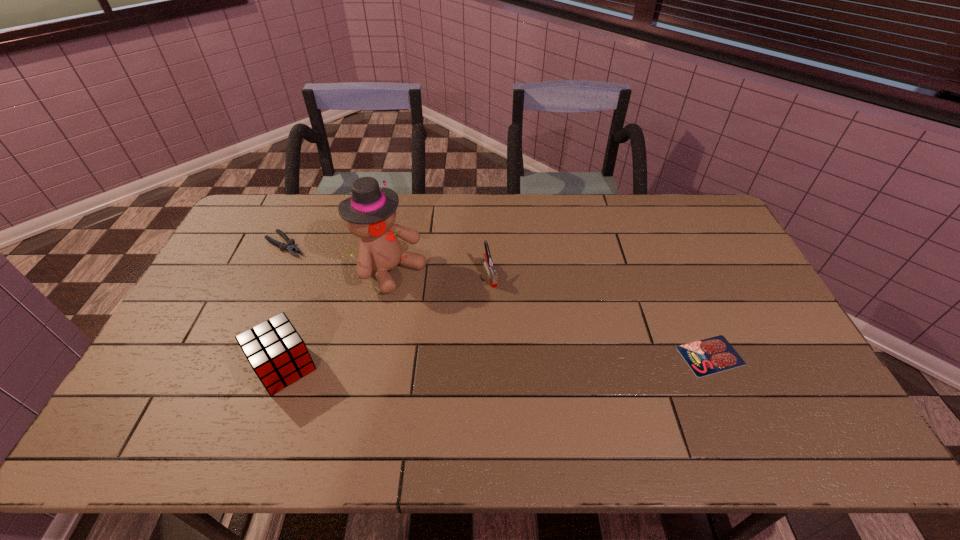
You are a GUI agent. You are given a task and a screenshot of the screen. Output one action in this format:
    pyautogui.click(x=<x>, y=<y>)
    Task: Click on the fourth shortest object
    This screenshot has height=540, width=960.
    Given the screenshot: What is the action you would take?
    pyautogui.click(x=278, y=355)

What are the coordinates of `the rightmost object` in the screenshot? It's located at (712, 355).

Locate an element on the screen. This screenshot has width=960, height=540. salami is located at coordinates (712, 355).

I want to click on rag_doll, so click(370, 213).

What are the coordinates of `the third object from right to left` in the screenshot? It's located at (370, 213).

This screenshot has height=540, width=960. What are the coordinates of `the third shortest object` in the screenshot? It's located at (491, 271).

You are a GUI agent. You are given a task and a screenshot of the screen. Output one action in this format:
    pyautogui.click(x=<x>, y=<y>)
    Task: Click on the stapler
    This screenshot has width=960, height=540.
    Given the screenshot: What is the action you would take?
    pyautogui.click(x=491, y=271)

Find the location of `the second shortest object`. the second shortest object is located at coordinates (290, 247).

You are a GUI agent. You are given a task and a screenshot of the screen. Output one action in this format:
    pyautogui.click(x=<x>, y=<y>)
    Task: Click on the free spot located 0.250m on the right of the cube
    The width and height of the screenshot is (960, 540).
    Given the screenshot: What is the action you would take?
    pyautogui.click(x=412, y=367)

This screenshot has height=540, width=960. What are the coordinates of `vacant space located 0.260m on the back of the shortest object` in the screenshot? It's located at (674, 269).